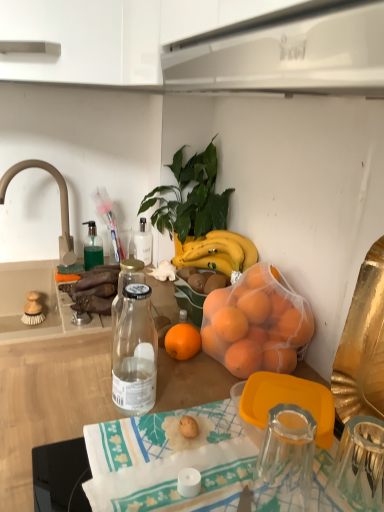
The width and height of the screenshot is (384, 512). What are the coordinates of `free point below beige matte faucet at upper left (from a real-world perspective)` in the screenshot? It's located at (65, 272).